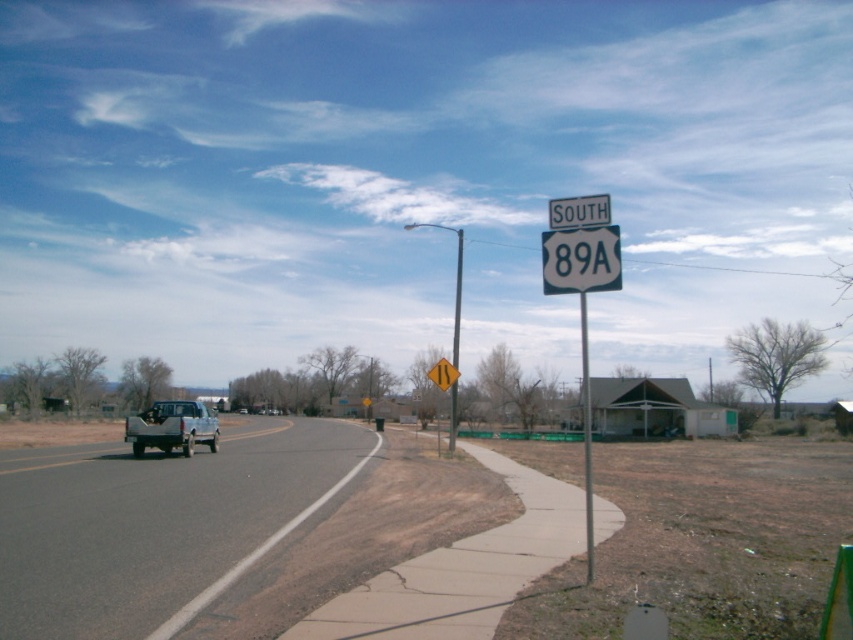
You are standing at the starting point of the road and want to reach the small house near the sidewalk. According to the image, where is the gray asphalt road at center in relation to your position?

The gray asphalt road at center is located at point (155,524), so you should head towards that coordinate to reach the road and then proceed towards the house.

You are standing at the point labeled as point (172, 428) in the image. What object is located at this point?

The point (172, 428) indicates the white matte truck at left.

Consider the image. You are driving a car and need to park on the gray asphalt road at center. There is a metallic pole at right nearby. According to the scene description, which object is closer to you as you approach the parking spot?

The gray asphalt road at center is closer to the viewer than the metallic pole at right, so the gray asphalt road at center would be closer as you approach the parking spot.